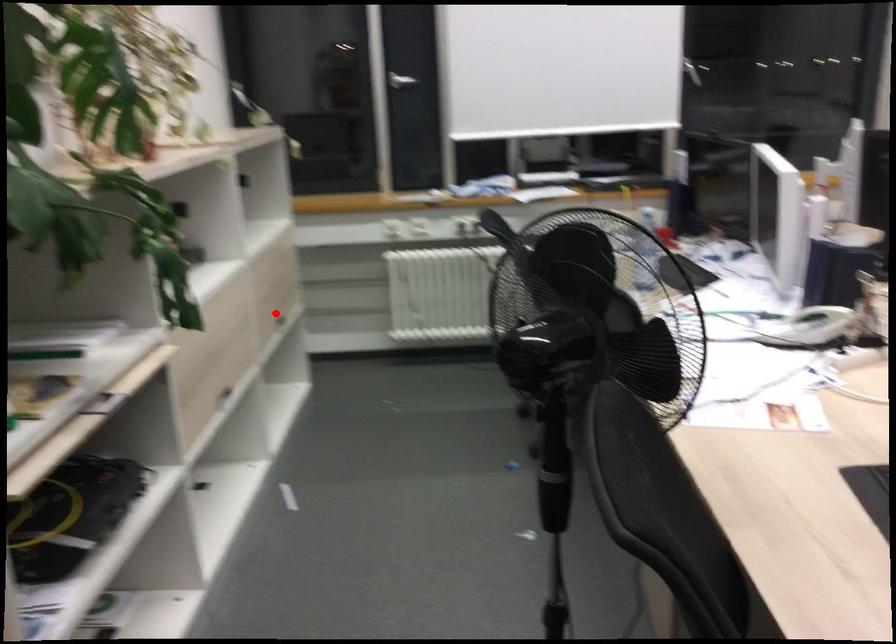
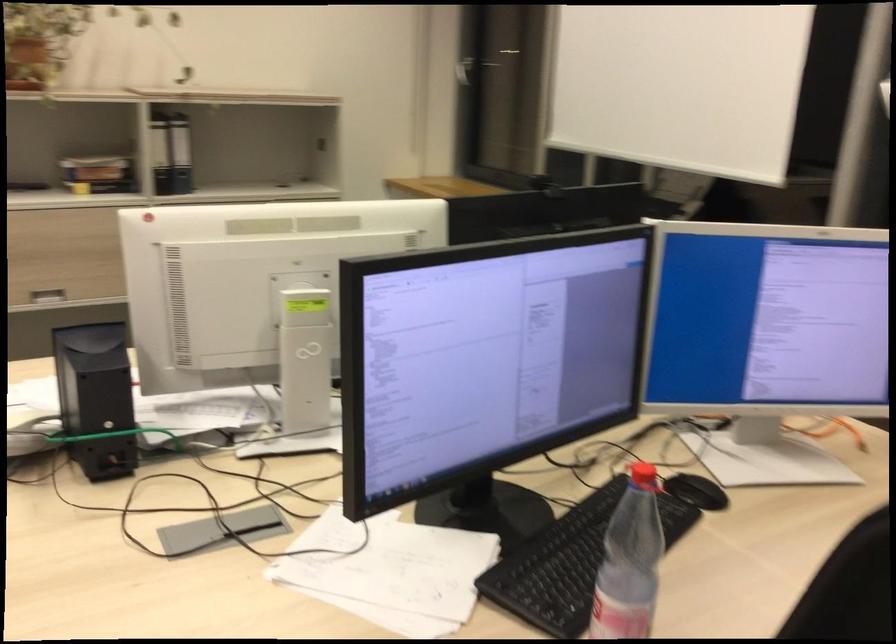
Question: I am providing you with two images of the same scene from different viewpoints. A red point is marked on the first image. Can you still see the location of the red point in image 2?

Choices:
 (A) Yes
 (B) No

Answer: (B)